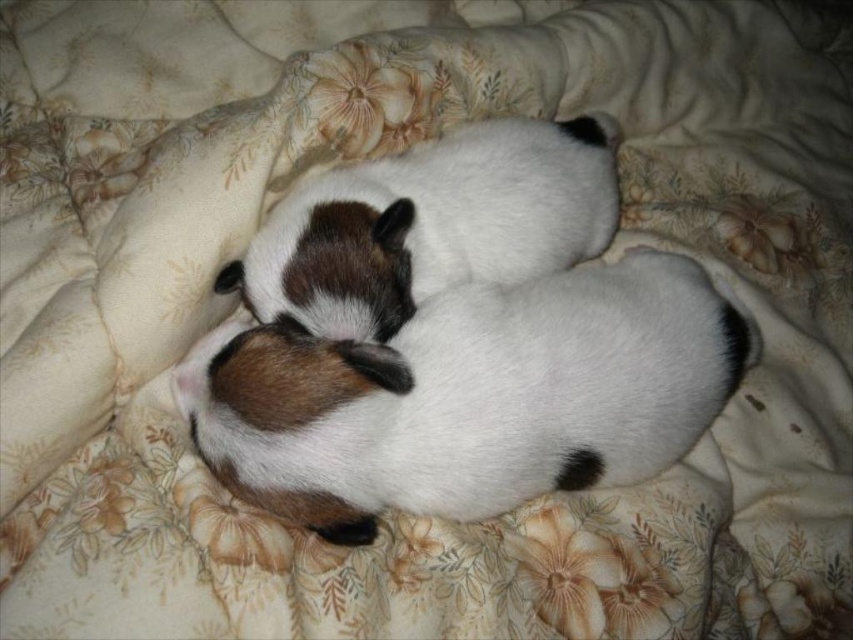
Question: Among these points, which one is farthest from the camera?

Choices:
 (A) (682, 349)
 (B) (395, 260)

Answer: (B)

Question: In this image, where is white fur dog at center located relative to white soft fur dog at center?

Choices:
 (A) below
 (B) above

Answer: (A)

Question: Does white fur dog at center appear over white soft fur dog at center?

Choices:
 (A) no
 (B) yes

Answer: (A)

Question: From the image, what is the correct spatial relationship of white fur dog at center in relation to white soft fur dog at center?

Choices:
 (A) above
 (B) below

Answer: (B)

Question: Among these points, which one is farthest from the camera?

Choices:
 (A) (509, 177)
 (B) (608, 419)

Answer: (A)